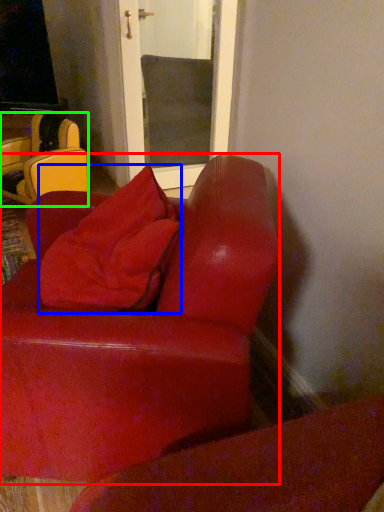
Question: Which object is the farthest from studio couch (highlighted by a red box)? Choose among these: throw pillow (highlighted by a blue box) or chair (highlighted by a green box).

Choices:
 (A) throw pillow
 (B) chair

Answer: (B)